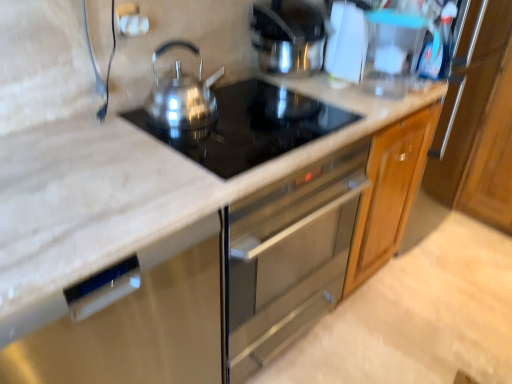
Question: Is satin black cooktop at center outside satin silver kettle at upper center, the first kitchen appliance positioned from the right?

Choices:
 (A) yes
 (B) no

Answer: (A)

Question: Is the position of satin black cooktop at center more distant than that of satin silver kettle at upper center, the 1th kitchen appliance in the back-to-front sequence?

Choices:
 (A) yes
 (B) no

Answer: (B)

Question: Is satin black cooktop at center at the right side of satin silver kettle at upper center, the first kitchen appliance positioned from the right?

Choices:
 (A) yes
 (B) no

Answer: (B)

Question: From the image's perspective, does satin black cooktop at center appear higher than satin silver kettle at upper center, which is the second kitchen appliance from front to back?

Choices:
 (A) yes
 (B) no

Answer: (B)

Question: Is satin black cooktop at center wider than satin silver kettle at upper center, which is the second kitchen appliance from front to back?

Choices:
 (A) yes
 (B) no

Answer: (A)

Question: Is black marble countertop at center to the left or to the right of satin silver kettle at center, which is the first kitchen appliance from left to right, in the image?

Choices:
 (A) left
 (B) right

Answer: (B)

Question: In terms of size, does black marble countertop at center appear bigger or smaller than satin silver kettle at center, the second kitchen appliance in the back-to-front sequence?

Choices:
 (A) small
 (B) big

Answer: (B)

Question: Do you think black marble countertop at center is within satin silver kettle at center, which is the second kitchen appliance from right to left, or outside of it?

Choices:
 (A) inside
 (B) outside

Answer: (B)

Question: From a real-world perspective, relative to satin silver kettle at center, which is the second kitchen appliance from right to left, is black marble countertop at center vertically above or below?

Choices:
 (A) below
 (B) above

Answer: (A)

Question: From a real-world perspective, is satin silver kettle at upper center, the second kitchen appliance viewed from the left, physically located above or below transparent plastic pitcher at upper right?

Choices:
 (A) above
 (B) below

Answer: (A)

Question: Looking at the image, does satin silver kettle at upper center, the first kitchen appliance positioned from the right, seem bigger or smaller compared to transparent plastic pitcher at upper right?

Choices:
 (A) small
 (B) big

Answer: (B)

Question: In terms of height, does satin silver kettle at upper center, the 1th kitchen appliance in the back-to-front sequence, look taller or shorter compared to transparent plastic pitcher at upper right?

Choices:
 (A) tall
 (B) short

Answer: (A)

Question: Is point [306, 13] positioned closer to the camera than point [376, 38]?

Choices:
 (A) farther
 (B) closer

Answer: (B)

Question: From a real-world perspective, is transparent plastic pitcher at upper right above or below black marble countertop at center?

Choices:
 (A) above
 (B) below

Answer: (A)

Question: Is transparent plastic pitcher at upper right taller or shorter than black marble countertop at center?

Choices:
 (A) short
 (B) tall

Answer: (A)